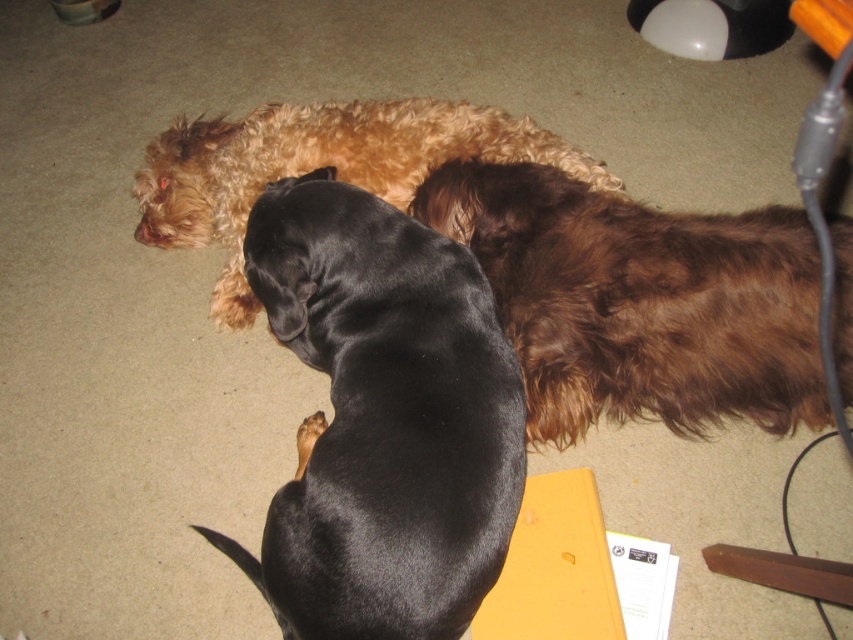
Question: Is black shiny dog at center to the left of brown fuzzy dog at center from the viewer's perspective?

Choices:
 (A) yes
 (B) no

Answer: (A)

Question: Which point is closer to the camera?

Choices:
 (A) (354, 113)
 (B) (331, 630)
 (C) (675, 387)

Answer: (B)

Question: Which object appears farthest from the camera in this image?

Choices:
 (A) golden brown fur at center
 (B) black shiny dog at center

Answer: (A)

Question: Among these objects, which one is farthest from the camera?

Choices:
 (A) golden brown fur at center
 (B) black shiny dog at center

Answer: (A)

Question: Can you confirm if black shiny dog at center is positioned to the left of golden brown fur at center?

Choices:
 (A) yes
 (B) no

Answer: (B)

Question: Does black shiny dog at center lie behind brown fuzzy dog at center?

Choices:
 (A) yes
 (B) no

Answer: (B)